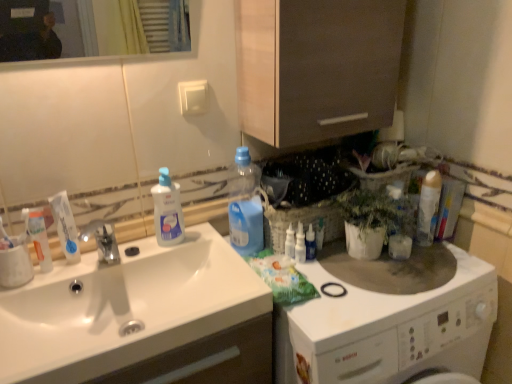
Identify the location of vacant space in front of translucent plastic bottles at center, placed as the third toiletry when sorted from right to left. The width and height of the screenshot is (512, 384). (323, 300).